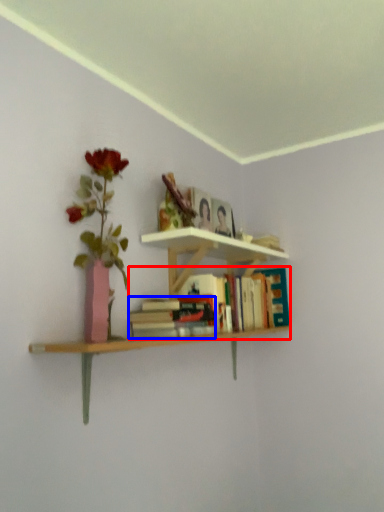
Question: Which object appears closest to the camera in this image, book (highlighted by a red box) or book (highlighted by a blue box)?

Choices:
 (A) book
 (B) book

Answer: (B)